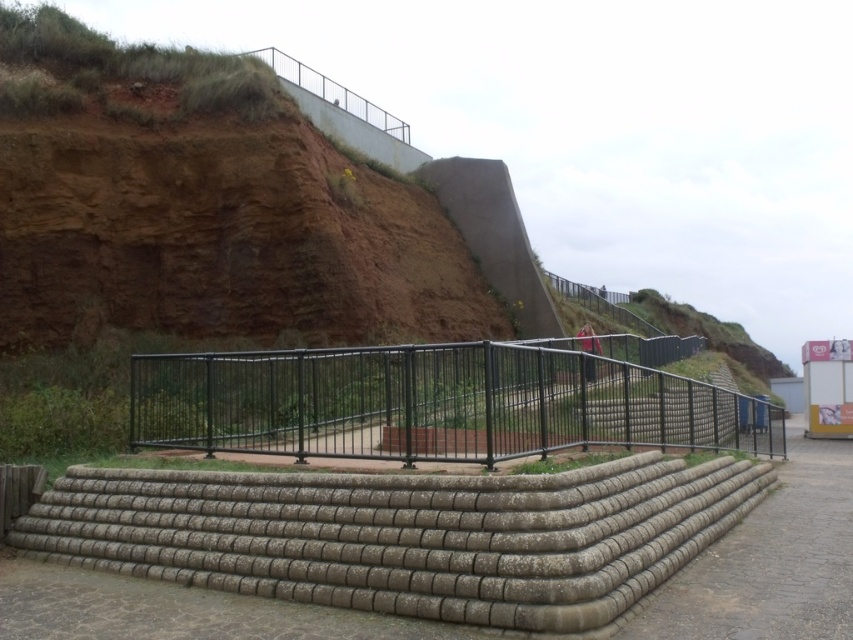
You are standing at the base of the stairs and want to reach the black metal fence at center. Which direction should you move relative to the concrete textured stairs at center to get closer to the fence?

You should move towards the concrete textured stairs at center because they are closer to the viewer than the black metal fence at center, so ascending them will bring you closer to the fence.

You are a delivery person carrying a heavy package and need to walk up the concrete textured stairs at center. The black metal fence at center is nearby. Considering their sizes, which object will be easier to navigate around?

The concrete textured stairs at center has a smaller size compared to the black metal fence at center, so it will be easier to navigate around the concrete textured stairs at center since it occupies less space.